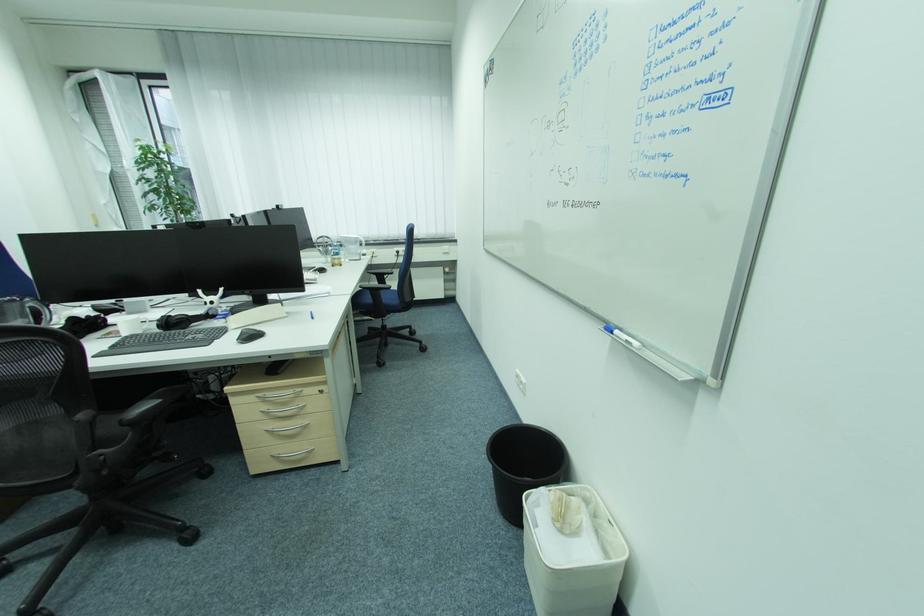
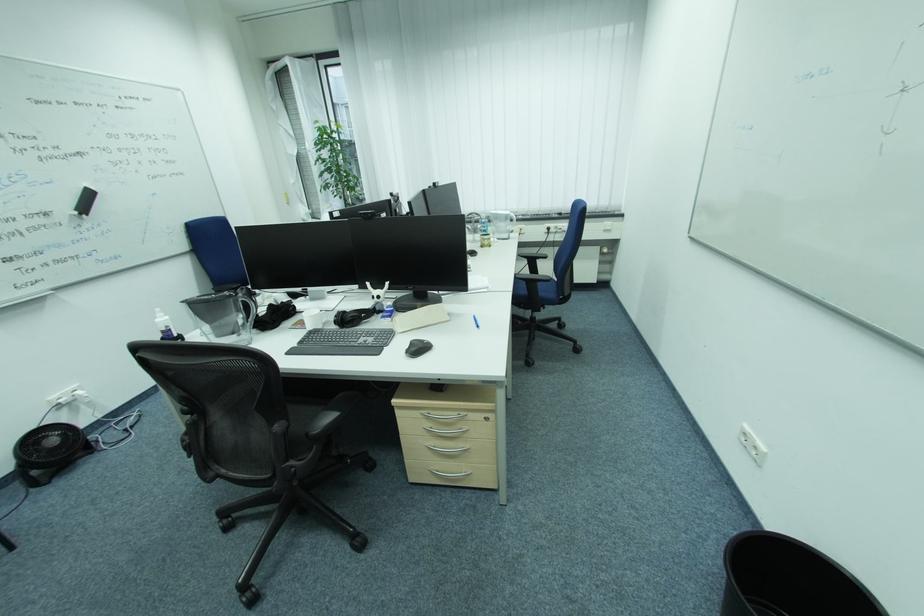
Locate, in the second image, the point that corresponds to point 102,418 in the first image.

(294, 429)